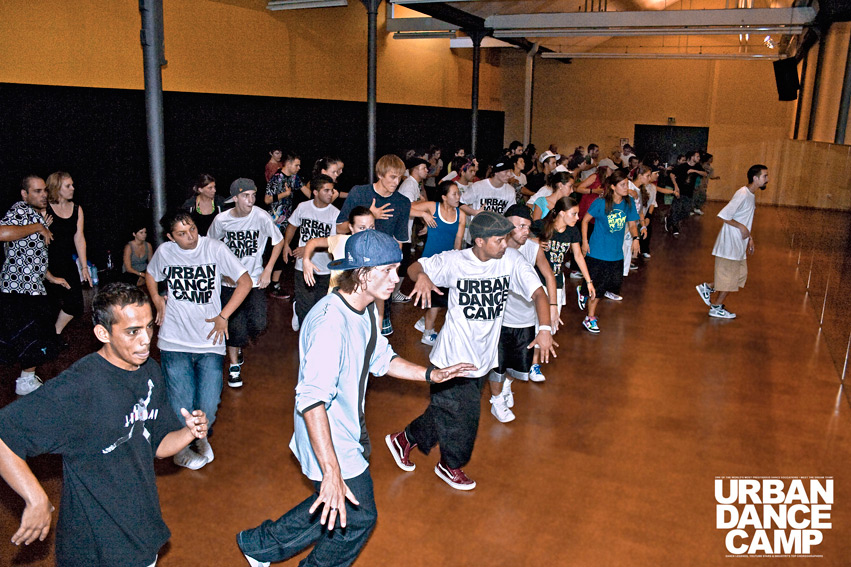
Find the location of a particular element. Image resolution: width=851 pixels, height=567 pixels. wooden floor is located at coordinates (617, 443).